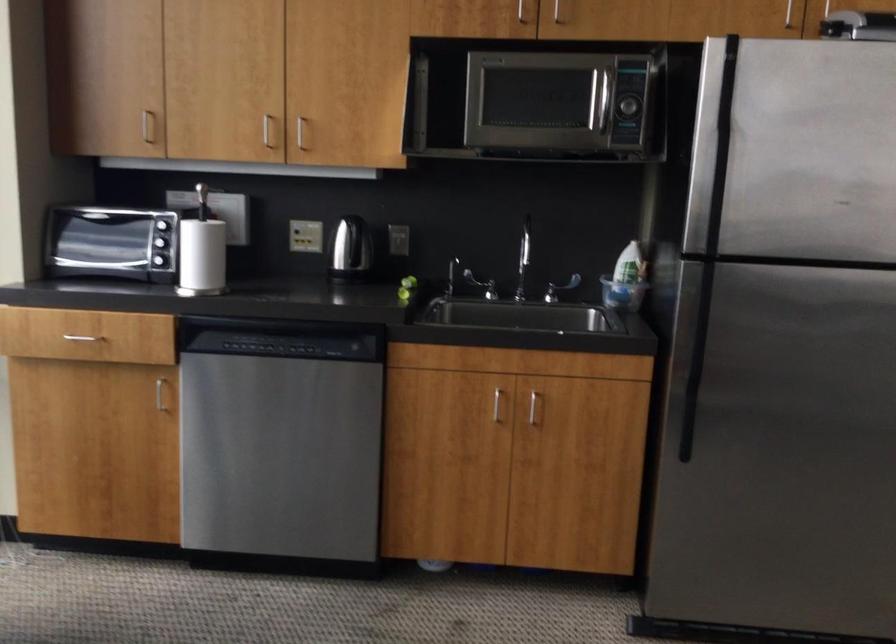
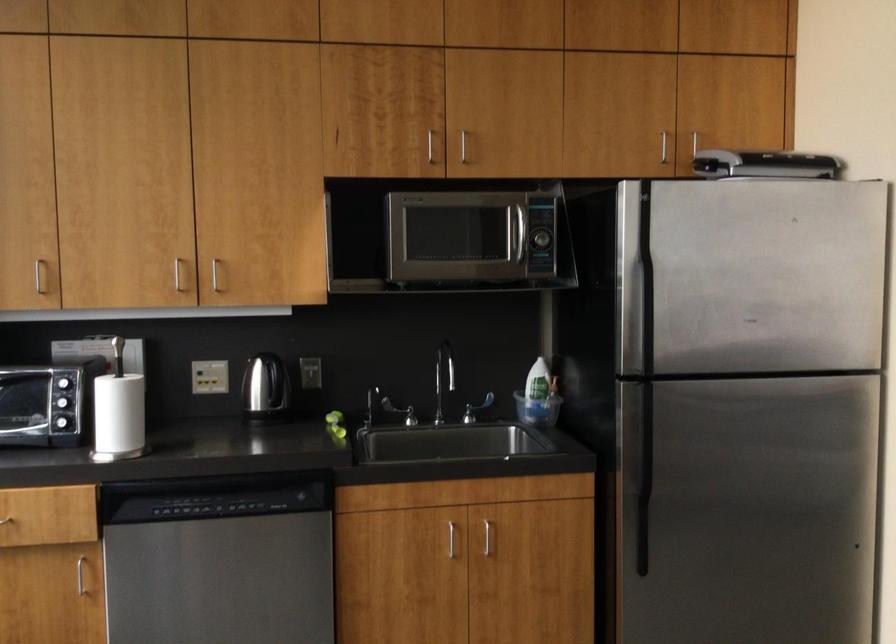
Find the pixel in the second image that matches (538,413) in the first image.

(490, 542)